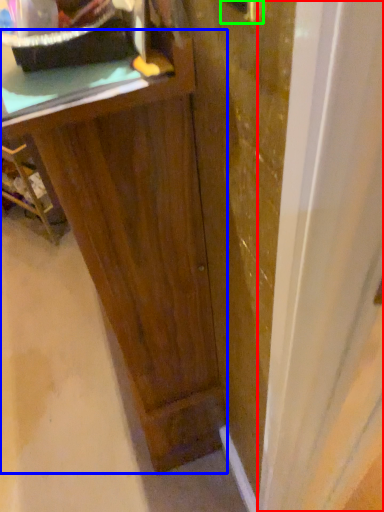
Question: Based on their relative distances, which object is farther from glass door (highlighted by a red box)? Choose from vanity (highlighted by a blue box) and door handle (highlighted by a green box).

Choices:
 (A) vanity
 (B) door handle

Answer: (B)